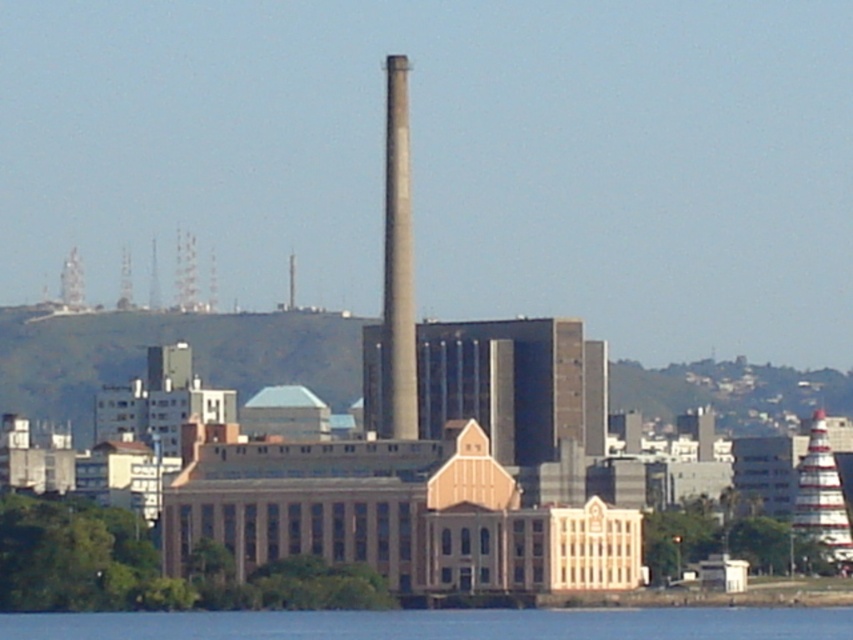
Question: Among these objects, which one is farthest from the camera?

Choices:
 (A) blue water at lower center
 (B) white striped tower at right

Answer: (B)

Question: Can you confirm if blue water at lower center is positioned above gray concrete tower at center?

Choices:
 (A) yes
 (B) no

Answer: (B)

Question: Based on their relative distances, which object is farther from the gray concrete tower at center?

Choices:
 (A) white striped tower at right
 (B) blue water at lower center

Answer: (A)

Question: Which point appears closest to the camera in this image?

Choices:
 (A) (398, 129)
 (B) (717, 608)

Answer: (A)

Question: Is blue water at lower center bigger than gray concrete tower at center?

Choices:
 (A) yes
 (B) no

Answer: (A)

Question: Does blue water at lower center have a larger size compared to gray concrete tower at center?

Choices:
 (A) yes
 (B) no

Answer: (A)